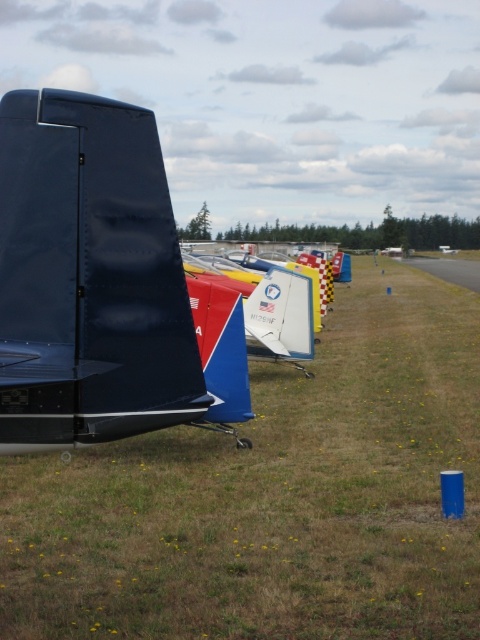
Does point (468, 541) lie in front of point (156, 161)?

No, (468, 541) is behind (156, 161).

Describe the element at coordinates (274, 497) in the screenshot. I see `green grass at center` at that location.

Is point (31, 524) more distant than point (7, 180)?

Yes.

In order to click on green grass at center in this screenshot , I will do `click(274, 497)`.

Which is behind, point (178, 380) or point (444, 252)?

Positioned behind is point (444, 252).

At what (x,y) coordinates should I click in order to perform the action: click on matte black airplane at center. Please return your answer as a coordinate pair (x, y). This screenshot has width=480, height=640. Looking at the image, I should click on (91, 280).

Who is more distant from viewer, (207,634) or (447,252)?

The point (447,252) is more distant.

Where is `green grass at center`? green grass at center is located at coordinates (274, 497).

This screenshot has width=480, height=640. Find the location of `green grass at center`. green grass at center is located at coordinates (274, 497).